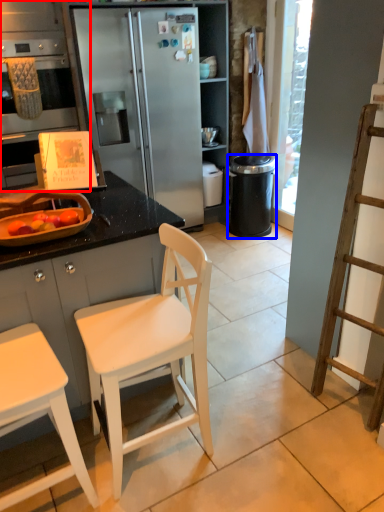
Question: Which object is further to the camera taking this photo, cabinetry (highlighted by a red box) or trash bin/can (highlighted by a blue box)?

Choices:
 (A) cabinetry
 (B) trash bin/can

Answer: (B)